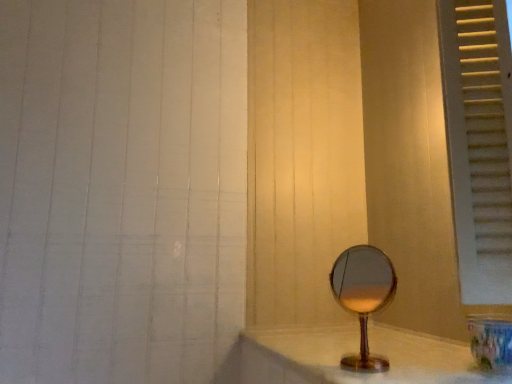
Where is `free space above translucent glass mirror at lower right (from a real-world perspective)`? This screenshot has width=512, height=384. free space above translucent glass mirror at lower right (from a real-world perspective) is located at coordinates (351, 332).